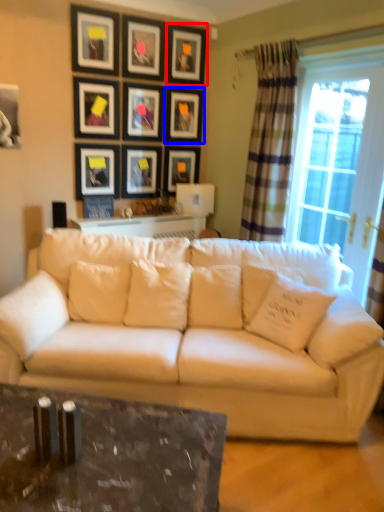
Question: Among these objects, which one is nearest to the camera, picture frame (highlighted by a red box) or picture frame (highlighted by a blue box)?

Choices:
 (A) picture frame
 (B) picture frame

Answer: (A)